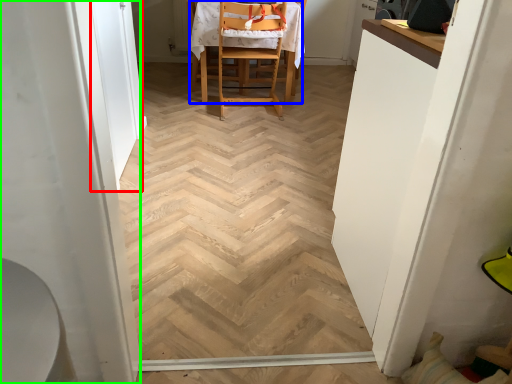
Question: Which object is positioned farthest from screen door (highlighted by a red box)? Select from chair (highlighted by a blue box) and screen door (highlighted by a green box).

Choices:
 (A) chair
 (B) screen door

Answer: (B)